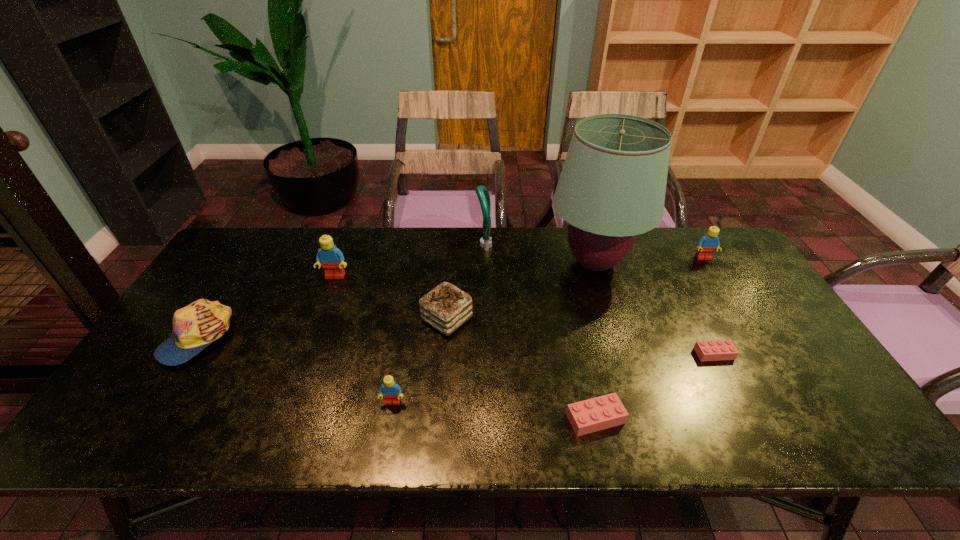
At what (x,y) coordinates should I click in order to perform the action: click on the smallest blue Lego. Please return your answer as a coordinate pair (x, y). This screenshot has height=540, width=960. Looking at the image, I should click on (391, 391).

Where is `the fourth Lego from right to left`? the fourth Lego from right to left is located at coordinates (391, 391).

Find the location of a particular element. the left pink Lego is located at coordinates (599, 413).

Find the location of `the nearer pink Lego`. the nearer pink Lego is located at coordinates coord(599,413).

Find the location of a particular element. The image size is (960, 540). the third farthest Lego is located at coordinates (714, 350).

Find the location of a particular element. Image resolution: width=960 pixels, height=540 pixels. the shortest object is located at coordinates (714, 350).

You are a GUI agent. You are given a task and a screenshot of the screen. Output one action in this format:
    pyautogui.click(x=<x>, y=<y>)
    Task: Click on the free spot located 0.250m on the right of the lampshade
    
    Given the screenshot: What is the action you would take?
    pyautogui.click(x=721, y=262)

This screenshot has width=960, height=540. Identify the location of blank area located at the jaws of the bottle opener. (408, 245).

Where is `blank space located 0.400m at the jaws of the bottle opener`? The image size is (960, 540). blank space located 0.400m at the jaws of the bottle opener is located at coordinates (357, 245).

Find the location of a particular element. The width and height of the screenshot is (960, 540). vacant space situated at the jaws of the bottle opener is located at coordinates (449, 245).